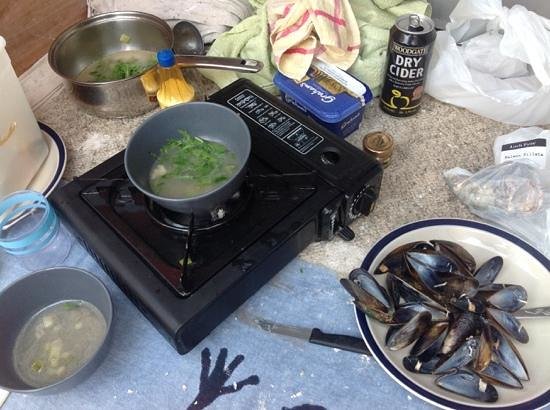
Identify the location of towels. (364, 35), (315, 12), (315, 209), (221, 16).